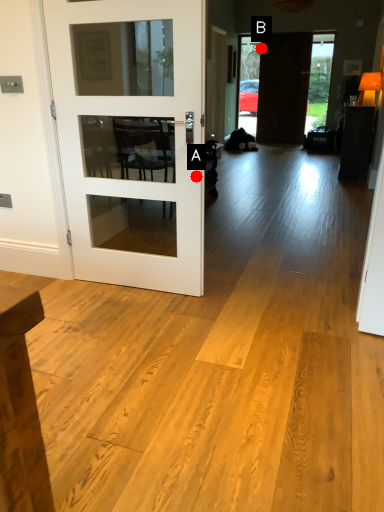
Question: Two points are circled on the image, labeled by A and B beside each circle. Among these points, which one is farthest from the camera?

Choices:
 (A) A is further
 (B) B is further

Answer: (B)